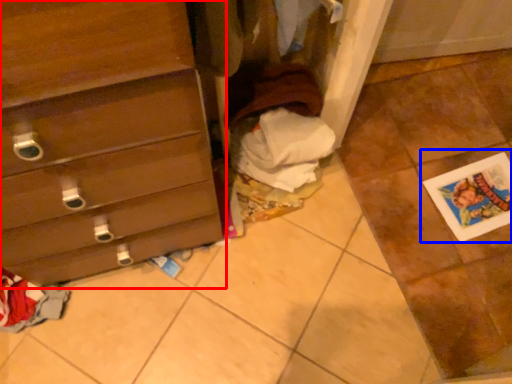
Question: Which point is closer to the camera, chest of drawers (highlighted by a red box) or postcard (highlighted by a blue box)?

Choices:
 (A) chest of drawers
 (B) postcard

Answer: (A)